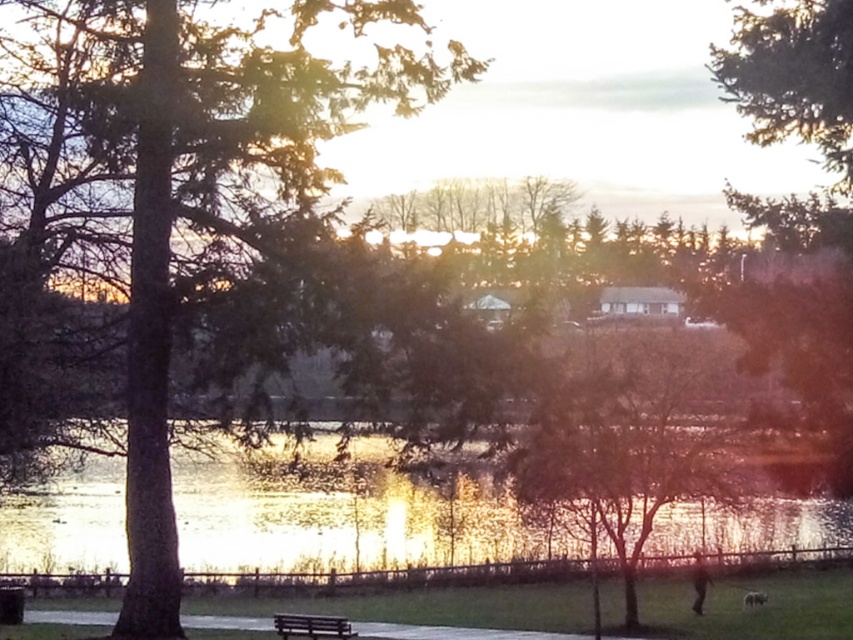
Question: Which of the following is the farthest from the observer?

Choices:
 (A) wooden bench at lower center
 (B) bare branches at center

Answer: (A)

Question: Estimate the real-world distances between objects in this image. Which object is farther from the green textured tree at left?

Choices:
 (A) glistening reflective water at center
 (B) wooden bench at lower center
 (C) bare branches at center

Answer: (B)

Question: Does bare branches at center appear on the right side of wooden bench at lower center?

Choices:
 (A) no
 (B) yes

Answer: (B)

Question: Which object appears closest to the camera in this image?

Choices:
 (A) green textured tree at left
 (B) wooden bench at lower center

Answer: (A)

Question: In this image, where is bare branches at center located relative to wooden bench at lower center?

Choices:
 (A) right
 (B) left

Answer: (A)

Question: Is bare branches at center behind wooden bench at lower center?

Choices:
 (A) yes
 (B) no

Answer: (B)